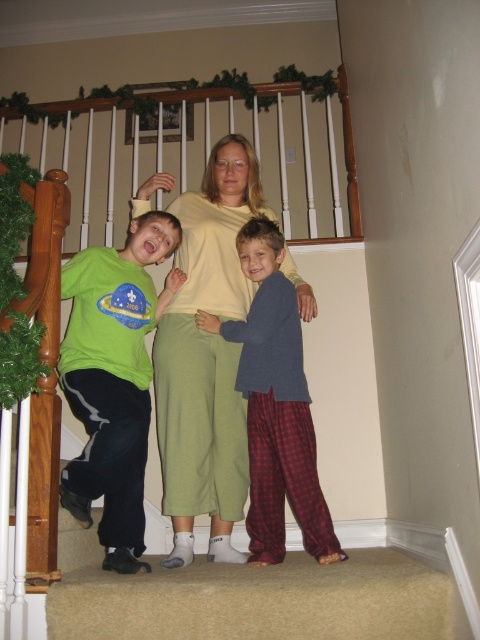
Does light yellow knit sweater at center have a lesser height compared to matte green shirt at left?

In fact, light yellow knit sweater at center may be taller than matte green shirt at left.

Is point (218, 172) positioned after point (112, 513)?

Yes, it is behind point (112, 513).

I want to click on light yellow knit sweater at center, so click(x=206, y=358).

The image size is (480, 640). I want to click on light yellow knit sweater at center, so click(206, 358).

Can you confirm if light yellow knit sweater at center is positioned to the right of carpet at lower center?

In fact, light yellow knit sweater at center is to the left of carpet at lower center.

Who is more distant from viewer, [166,390] or [109,589]?

The point [166,390] is behind.

This screenshot has height=640, width=480. Find the location of `light yellow knit sweater at center`. light yellow knit sweater at center is located at coordinates (206, 358).

Can you confirm if carpet at lower center is smaller than blue fleece sweater at center?

Yes, carpet at lower center is smaller than blue fleece sweater at center.

Is point (388, 554) farther from camera compared to point (280, 390)?

Yes.

Find the location of a particular element. The width and height of the screenshot is (480, 640). carpet at lower center is located at coordinates (249, 596).